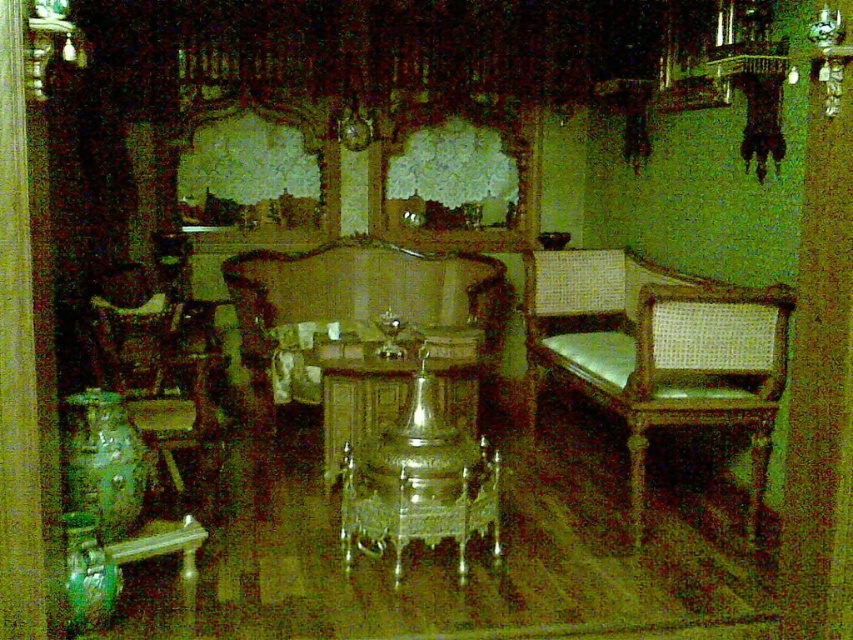
Between wooden polished table at center and wooden armchair at left, which one has more height?

wooden armchair at left is taller.

Does wooden polished table at center have a greater height compared to wooden armchair at left?

No.

Where is `wooden polished table at center`? The height and width of the screenshot is (640, 853). wooden polished table at center is located at coordinates coord(398,406).

Based on the photo, is wooden armchair at center taller than wooden armchair at left?

Yes, wooden armchair at center is taller than wooden armchair at left.

Does wooden armchair at center have a greater width compared to wooden armchair at left?

Yes.

Is point (270, 353) in front of point (140, 353)?

No, it is not.

The height and width of the screenshot is (640, 853). I want to click on wooden armchair at center, so click(355, 300).

Is woven wood armchair at right above wooden armchair at center?

Incorrect, woven wood armchair at right is not positioned above wooden armchair at center.

Is woven wood armchair at right in front of wooden armchair at center?

Yes.

Is point (635, 348) farther from camera compared to point (354, 282)?

No, (635, 348) is closer to viewer.

Identify the location of woven wood armchair at right. This screenshot has width=853, height=640. (659, 352).